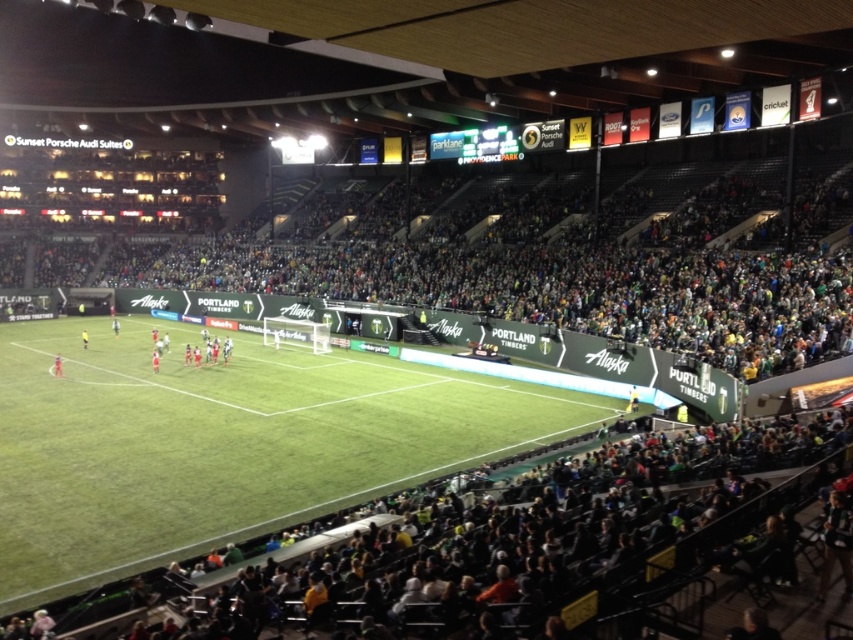
You are a soccer player standing at the edge of the field. You need to kick the ball to the goal located at the far end of the field. Which object, the green artificial turf at center or the green fabric crowd at center, will the ball first hit after being kicked?

The ball will first hit the green artificial turf at center because it is in front of the green fabric crowd at center.

You are a photographer at Providence Park stadium during a soccer match. You want to capture a photo of the red fabric person at center and the yellow fabric person at center. Which one appears smaller in the photo?

The red fabric person at center appears smaller in the photo because its width is less than the yellow fabric person at center.